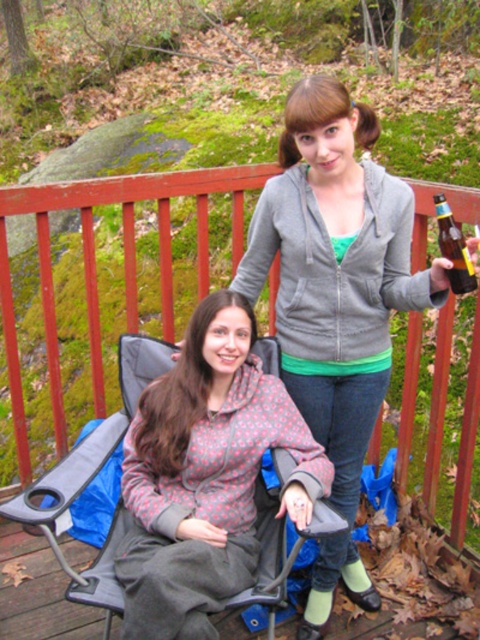
Question: Is matte gray hoodie at center wider than brown glass bottle at upper right?

Choices:
 (A) yes
 (B) no

Answer: (A)

Question: Which point appears farthest from the camera in this image?

Choices:
 (A) (374, 124)
 (B) (251, 310)
 (C) (296, 448)

Answer: (B)

Question: Which object is closer to the camera taking this photo?

Choices:
 (A) brown glass bottle at upper right
 (B) printed cotton shirt at center

Answer: (A)

Question: Is matte gray hoodie at center bigger than matte gray hoodie at upper center?

Choices:
 (A) no
 (B) yes

Answer: (B)

Question: Does floral-patterned hoodie at center have a smaller size compared to brown glass bottle at upper right?

Choices:
 (A) no
 (B) yes

Answer: (A)

Question: Which point appears farthest from the camera in this image?

Choices:
 (A) (304, 115)
 (B) (175, 429)

Answer: (B)